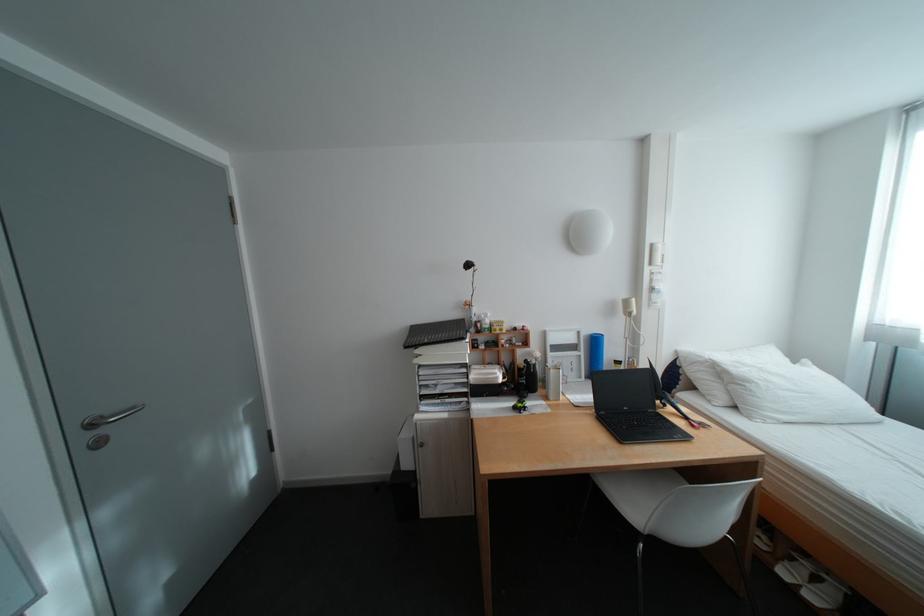
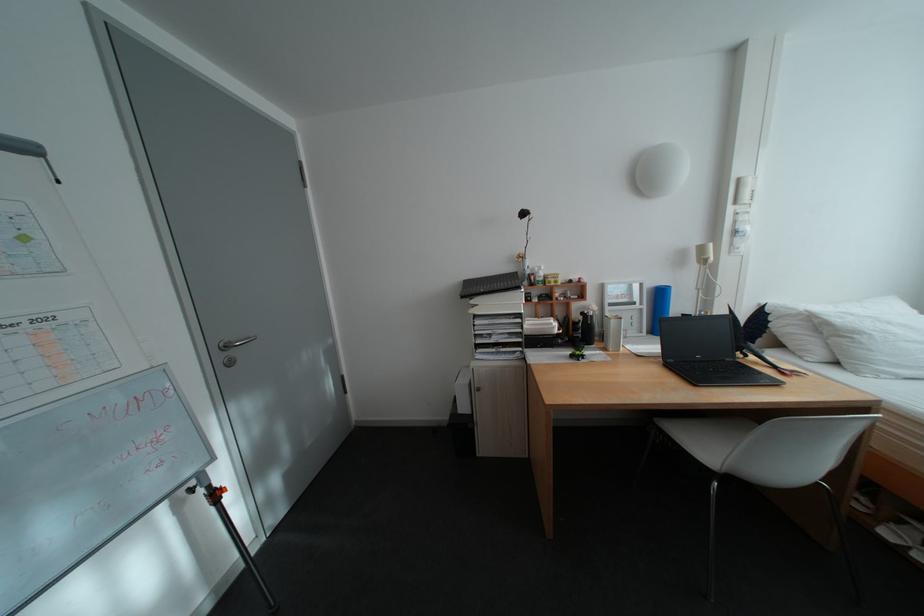
In the second image, find the point that corresponds to (x=761, y=384) in the first image.

(871, 334)